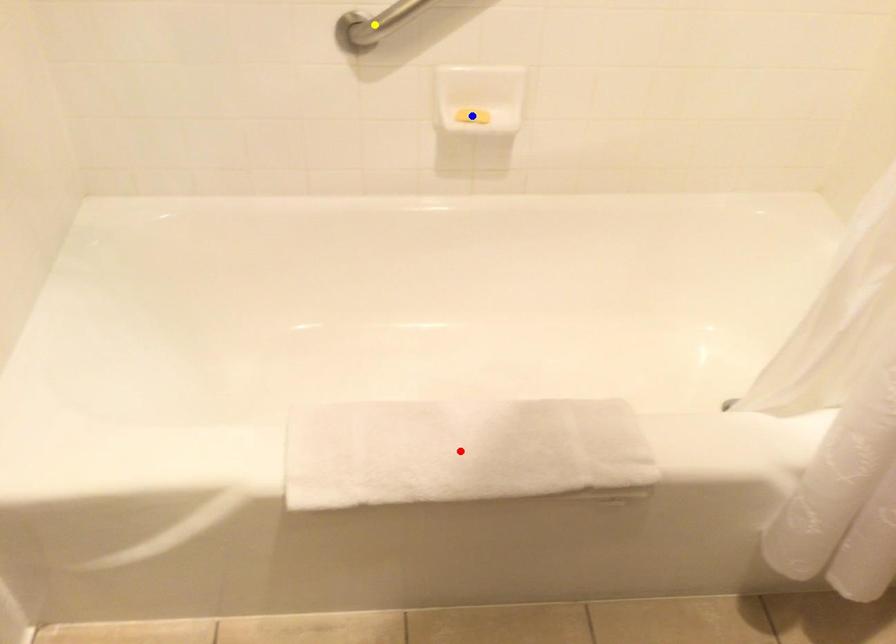
Order these from nearest to farthest:
blue point
red point
yellow point

red point → yellow point → blue point